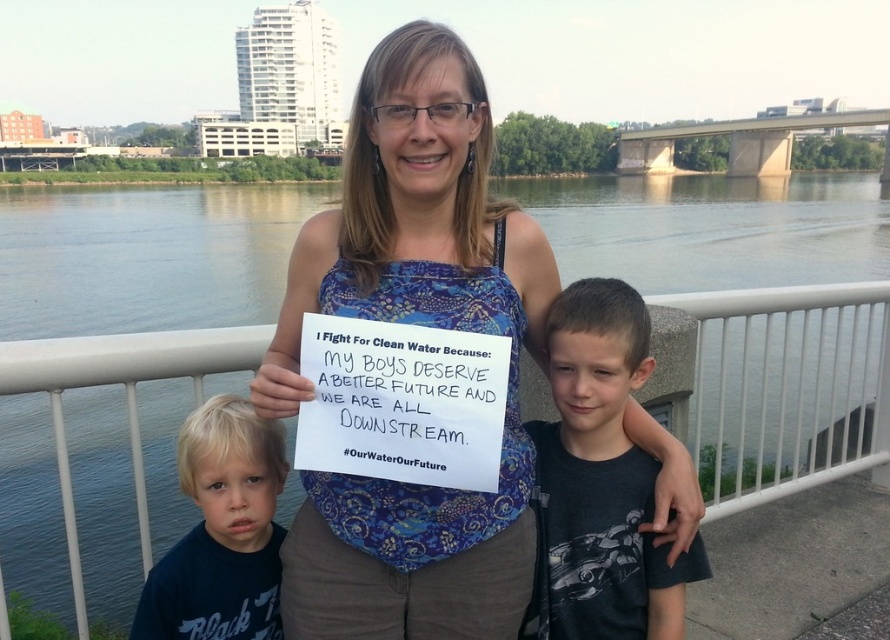
You are a photographer trying to capture a clear shot of the blue patterned tank top at center and the green water at center. Which object should you focus on first to ensure both are in focus?

The blue patterned tank top at center is closer to you than the green water at center. To ensure both are in focus, you should focus on the blue patterned tank top at center first.

You are a photographer trying to capture a clear shot of the blue patterned tank top at center and the green water at center. Based on their sizes in the image, which one do you think occupies more horizontal space in the photo?

The green water at center might be wider than blue patterned tank top at center, so it likely occupies more horizontal space in the photo.